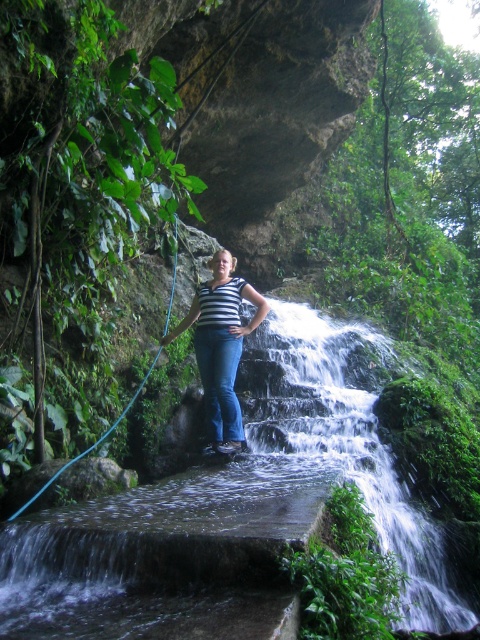
Which is behind, point (299, 326) or point (134, 392)?

Point (299, 326)

Which is in front, point (360, 449) or point (167, 314)?

Point (360, 449) is more forward.

What do you see at coordinates (340, 442) in the screenshot? I see `white frothy water at center` at bounding box center [340, 442].

This screenshot has width=480, height=640. In order to click on white frothy water at center in this screenshot , I will do `click(340, 442)`.

Is point (367, 460) in front of point (224, 314)?

That is True.

Can you confirm if white frothy water at center is taller than striped shirt at center?

Yes, white frothy water at center is taller than striped shirt at center.

Is point (376, 435) closer to viewer compared to point (229, 272)?

No, (376, 435) is further to viewer.

You are a GUI agent. You are given a task and a screenshot of the screen. Output one action in this format:
    pyautogui.click(x=<x>, y=<y>)
    Task: Click on the white frothy water at center
    
    Given the screenshot: What is the action you would take?
    pyautogui.click(x=340, y=442)

Is point (222, 451) more distant than point (67, 461)?

Yes, it is behind point (67, 461).

Who is higher up, striped shirt at center or blue rubber hose at center?

blue rubber hose at center is higher up.

Locate an element on the screen. The width and height of the screenshot is (480, 640). striped shirt at center is located at coordinates (220, 346).